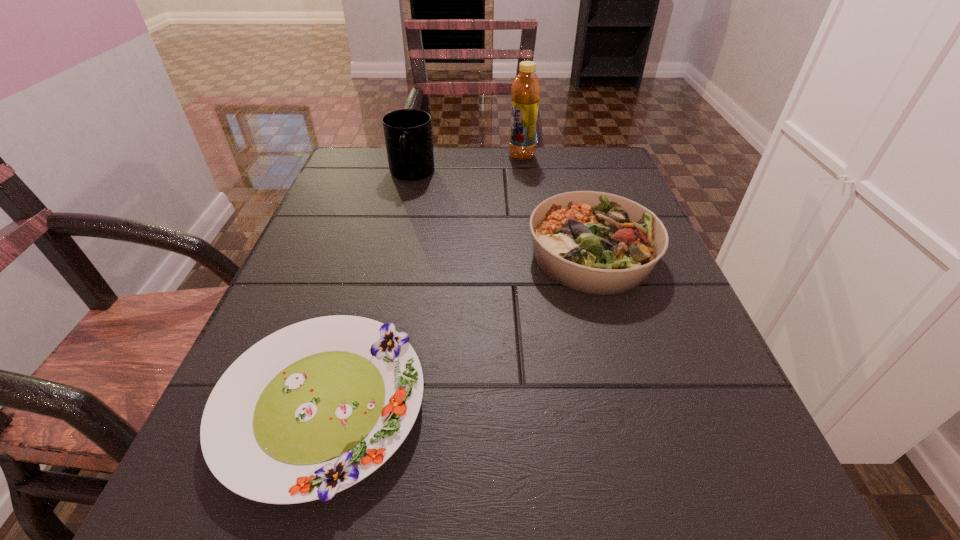
Where is `bottle that is at the far edge`? This screenshot has width=960, height=540. bottle that is at the far edge is located at coordinates (526, 88).

You are a GUI agent. You are given a task and a screenshot of the screen. Output one action in this format:
    pyautogui.click(x=<x>, y=<y>)
    Task: Click on the mug located in the far edge section of the desktop
    The image size is (960, 540).
    Given the screenshot: What is the action you would take?
    pyautogui.click(x=408, y=132)

Where is `object positioned at the near edge`? This screenshot has height=540, width=960. object positioned at the near edge is located at coordinates (312, 409).

At what (x,y) coordinates should I click in order to perform the action: click on mug that is at the left edge. Please return your answer as a coordinate pair (x, y). The height and width of the screenshot is (540, 960). Looking at the image, I should click on (408, 132).

Find the location of a particular element. The height and width of the screenshot is (540, 960). salad plate that is at the left edge is located at coordinates point(312,409).

The image size is (960, 540). In order to click on object that is at the right edge in this screenshot , I will do `click(594, 242)`.

You are a GUI agent. You are given a task and a screenshot of the screen. Output one action in this format:
    pyautogui.click(x=<x>, y=<y>)
    Task: Click on the object at the far left corner
    
    Given the screenshot: What is the action you would take?
    pyautogui.click(x=408, y=132)

You are a GUI agent. You are given a task and a screenshot of the screen. Output one action in this format:
    pyautogui.click(x=<x>, y=<y>)
    Task: Click on the object that is positioned at the near left corner
    
    Given the screenshot: What is the action you would take?
    pyautogui.click(x=312, y=409)

Find the location of a particular element. This screenshot has height=540, width=960. vacant space at the far edge is located at coordinates (437, 154).

In the image, there is a desktop. At what (x,y) coordinates should I click in order to perform the action: click on free region at the left edge. Please return your answer as a coordinate pair (x, y). The image size is (960, 540). Looking at the image, I should click on (317, 240).